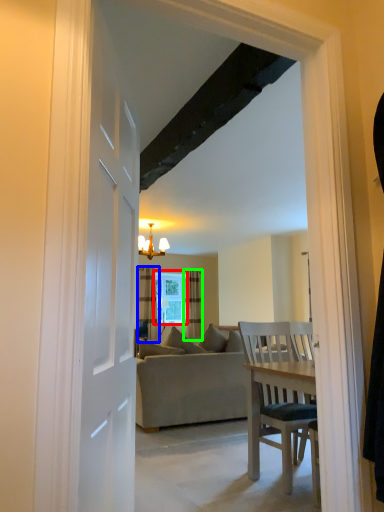
Question: Based on their relative distances, which object is nearer to window (highlighted by a red box)? Choose from curtain (highlighted by a blue box) and curtain (highlighted by a green box).

Choices:
 (A) curtain
 (B) curtain

Answer: (B)